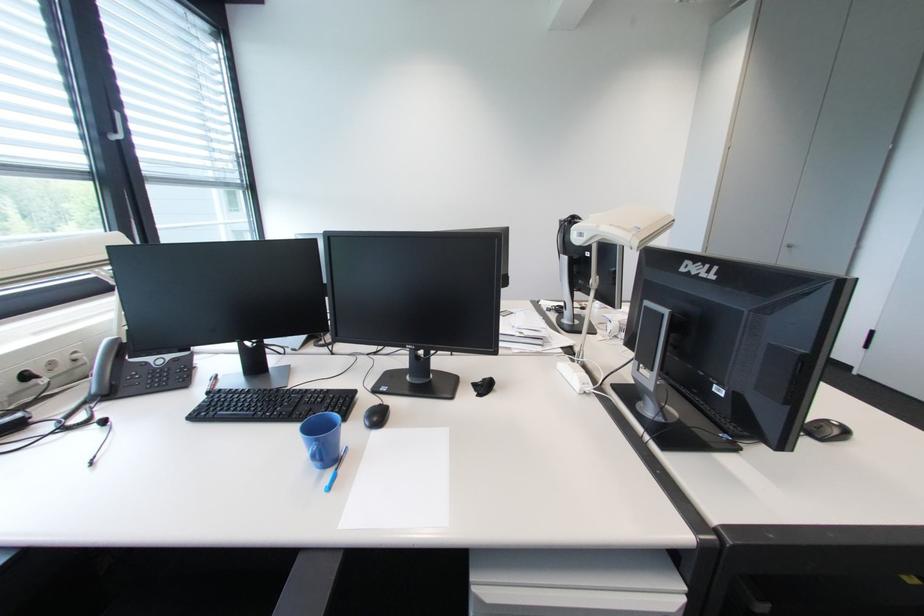
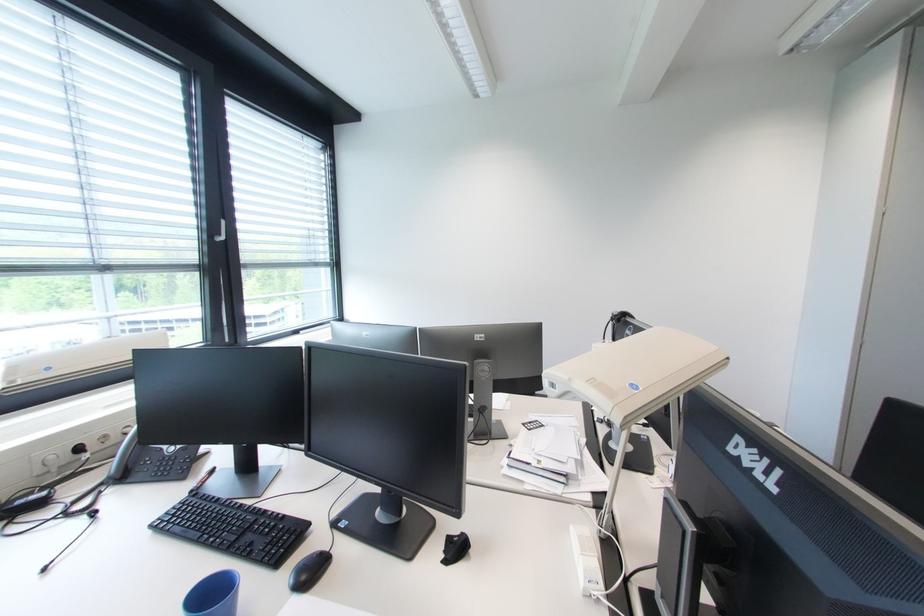
Where in the second image is the point corresponding to (382,421) from the first image?

(310, 578)